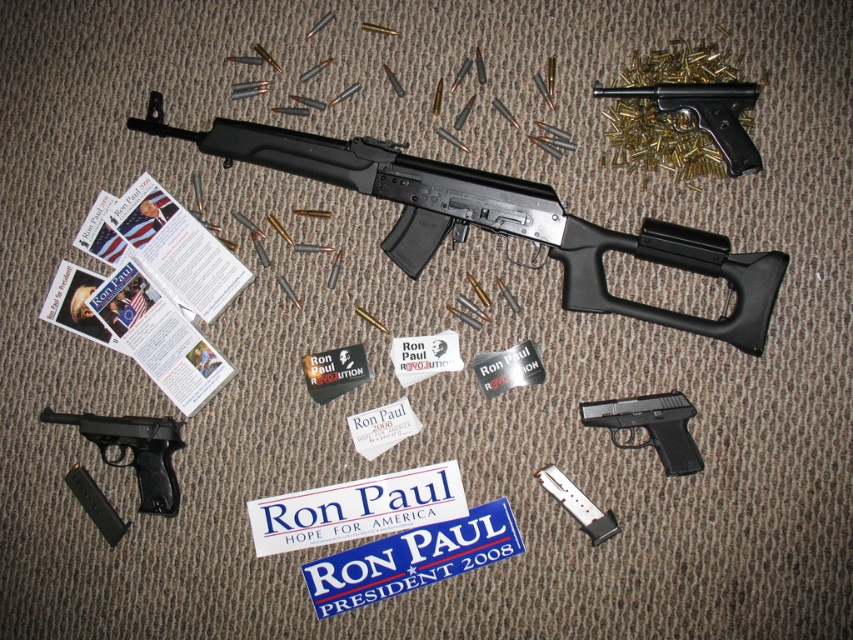
Is black plastic handgun at lower left thinner than matte black handgun at upper right?

Yes.

Who is more distant from viewer, (160,417) or (724,115)?

The point (160,417) is behind.

Which is in front, point (143, 428) or point (616, 90)?

Positioned in front is point (616, 90).

This screenshot has height=640, width=853. Find the location of `black plastic handgun at lower left`. black plastic handgun at lower left is located at coordinates (135, 451).

Between point (215, 154) and point (585, 416), which one is positioned in front?

Point (585, 416)

Looking at this image, is black plastic rifle at center closer to camera compared to black plastic handgun at center?

Yes, black plastic rifle at center is in front of black plastic handgun at center.

Where is `black plastic rifle at center`? The image size is (853, 640). black plastic rifle at center is located at coordinates (502, 220).

Is the position of matte black handgun at upper right more distant than that of black plastic handgun at center?

No, it is not.

Which is more to the left, matte black handgun at upper right or black plastic handgun at center?

Positioned to the left is black plastic handgun at center.

Between point (711, 109) and point (680, 449), which one is positioned in front?

Positioned in front is point (711, 109).

Locate an element on the screen. matte black handgun at upper right is located at coordinates (706, 113).